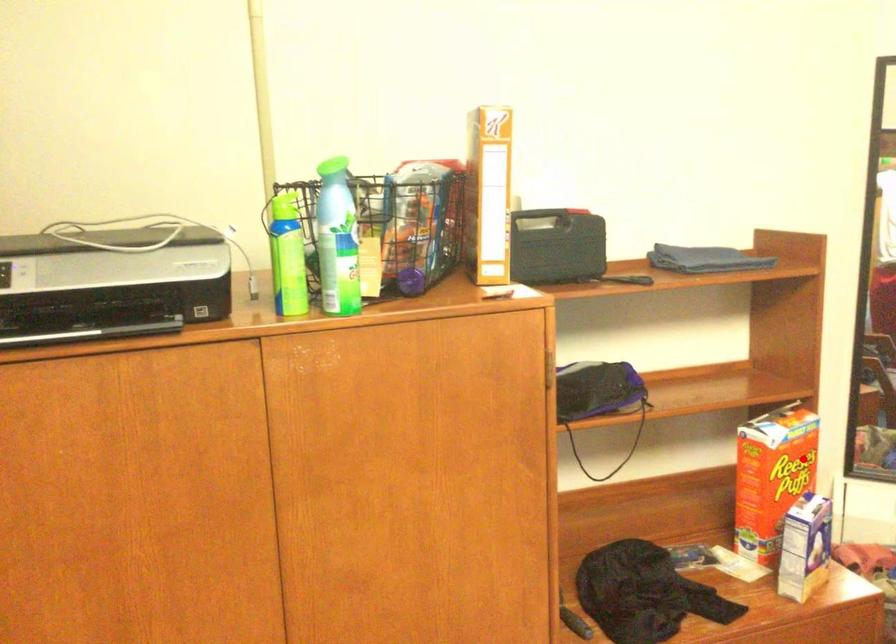
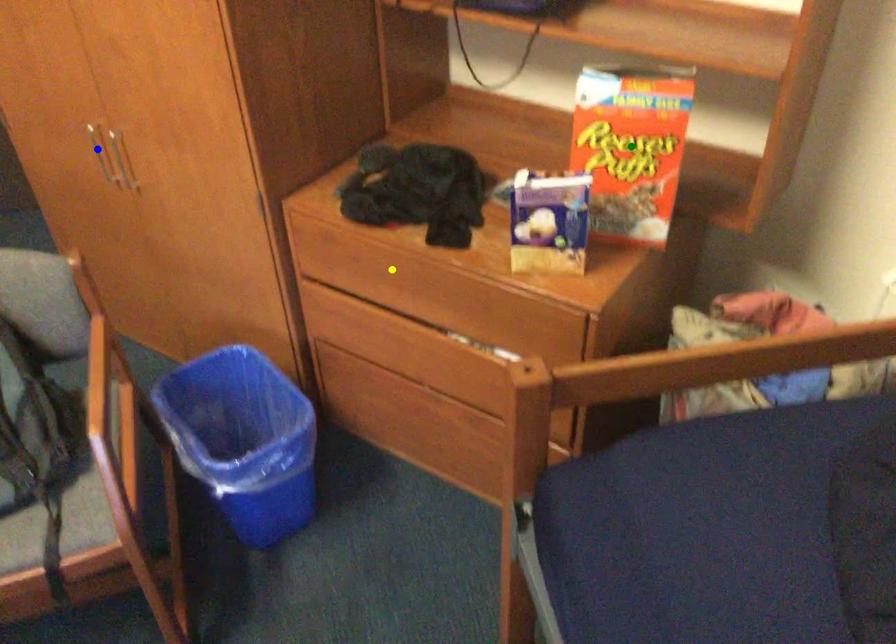
Question: I am providing you with two images of the same scene from different viewpoints. A red point is marked on the first image. You are given multiple points on the second image. Which spot in image 2 lines up with the point in image 1?

Choices:
 (A) yellow point
 (B) blue point
 (C) green point

Answer: (C)